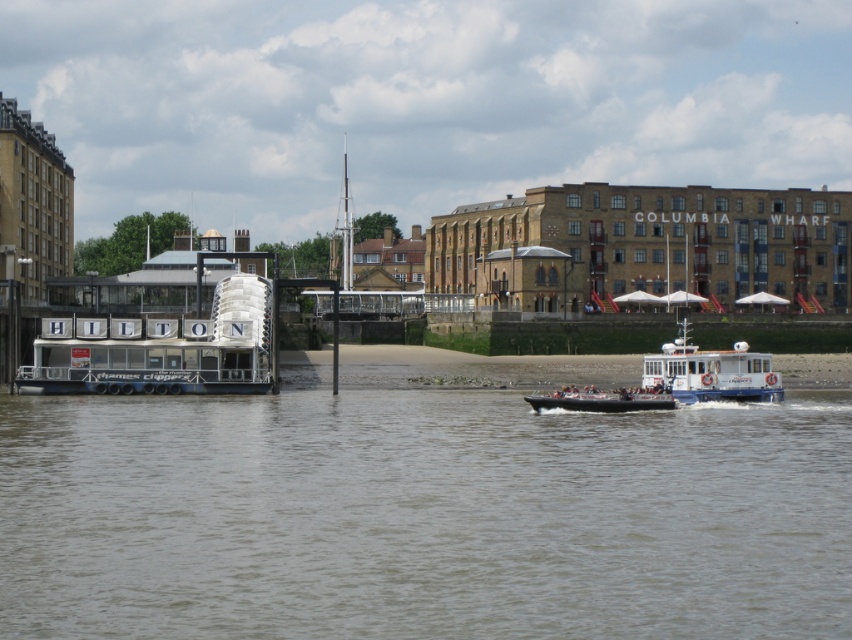
You are standing at the riverside and want to determine which of the two points, point (66,589) or point (249,372), is closer to you. Based on the scene, which point is nearer?

Point (66,589) is closer to the viewer than point (249,372).

You are a passenger on the Thames Clippers service and want to board a boat. You see the white matte boat at left and the white plastic boat at center. Which boat is taller?

The white matte boat at left is much taller than the white plastic boat at center.